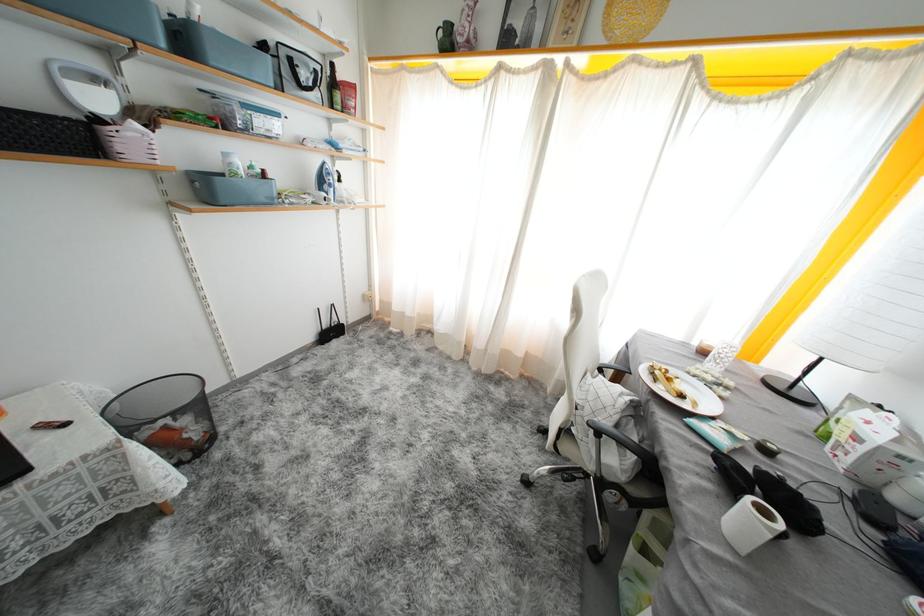
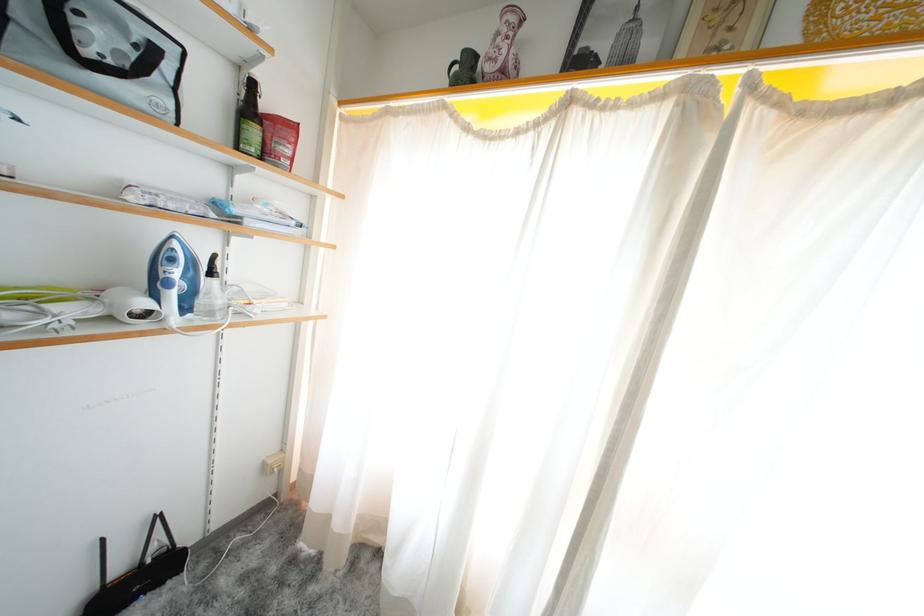
Where in the second image is the point corresponding to (x=334, y=177) from the first image?

(178, 264)